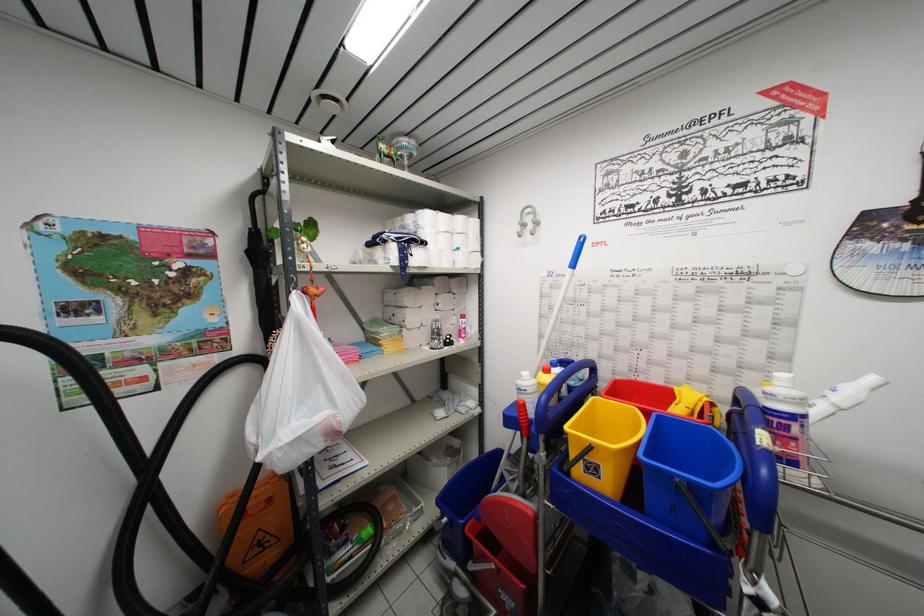
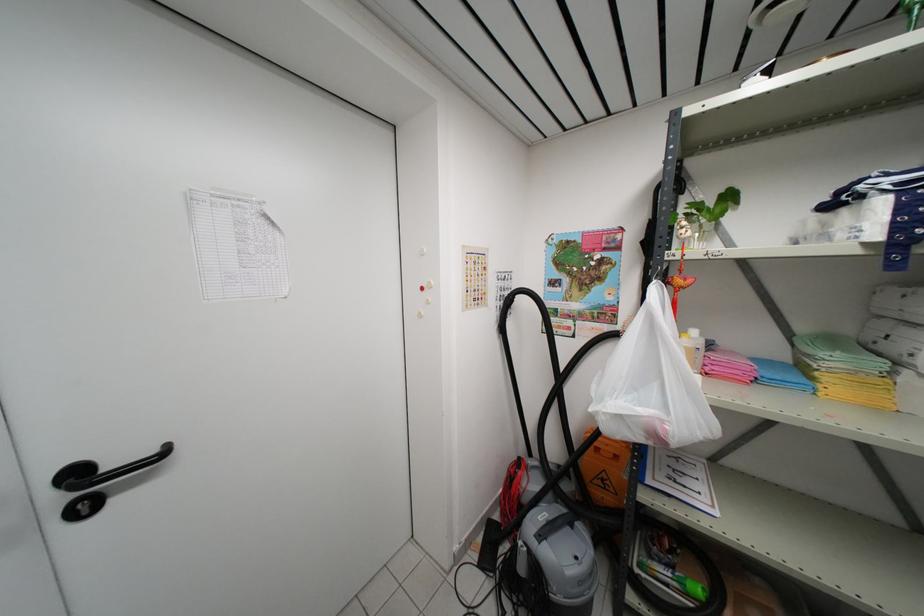
In the second image, find the point that corresponds to (342,427) in the first image.

(670, 435)